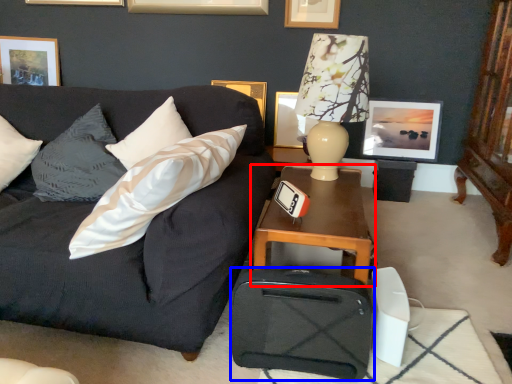
Question: Which of the following is the closest to the observer, table (highlighted by a red box) or luggage (highlighted by a blue box)?

Choices:
 (A) table
 (B) luggage

Answer: (B)